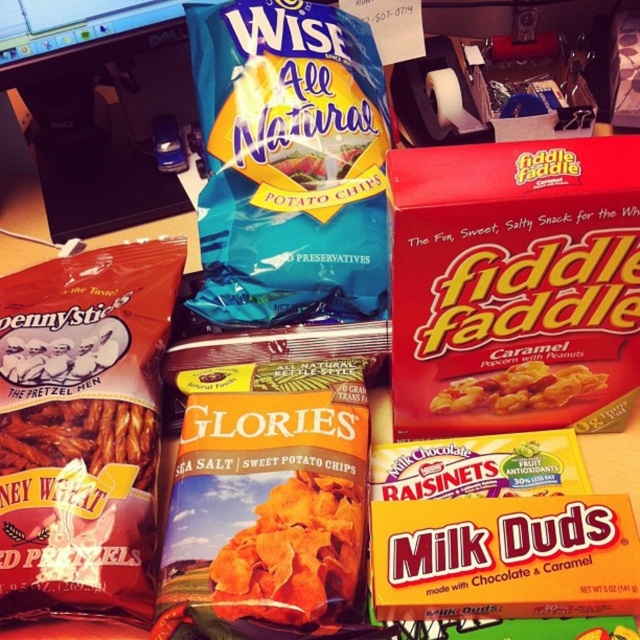
Question: Is red cardboard box at upper right bigger than caramel popcorn at center?

Choices:
 (A) yes
 (B) no

Answer: (A)

Question: Can you confirm if red cardboard box at upper right is positioned below caramel popcorn at center?

Choices:
 (A) yes
 (B) no

Answer: (B)

Question: Does red cardboard box at upper right appear over caramel popcorn at center?

Choices:
 (A) no
 (B) yes

Answer: (B)